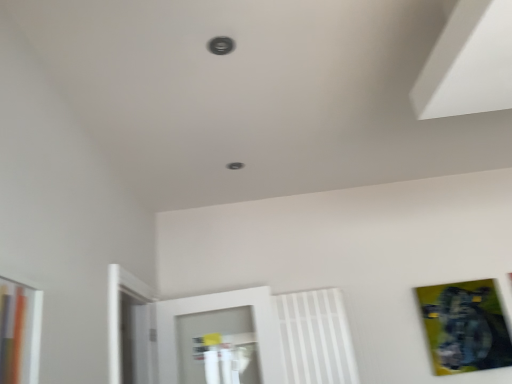
Find the location of a particular element. The width and height of the screenshot is (512, 384). white plastic radiator at center is located at coordinates (315, 337).

What do you see at coordinates (221, 45) in the screenshot? The height and width of the screenshot is (384, 512). I see `metallic circular hole at upper center, marked as the first hole in a top-to-bottom arrangement` at bounding box center [221, 45].

You are a GUI agent. You are given a task and a screenshot of the screen. Output one action in this format:
    pyautogui.click(x=<x>, y=<y>)
    Task: Click on the metallic gold picture frame at lower right
    Image resolution: width=512 pixels, height=384 pixels.
    Given the screenshot: What is the action you would take?
    pyautogui.click(x=465, y=327)

Describe the element at coordinates (465, 327) in the screenshot. I see `metallic gold picture frame at lower right` at that location.

At what (x,y) coordinates should I click in order to perform the action: click on white plastic radiator at center. Please return your answer as a coordinate pair (x, y). The width and height of the screenshot is (512, 384). Looking at the image, I should click on (315, 337).

From the picture: Is metallic gold picture frame at lower right wider or thinner than white plastic radiator at center?

Considering their sizes, metallic gold picture frame at lower right looks slimmer than white plastic radiator at center.

From a real-world perspective, who is located higher, metallic gold picture frame at lower right or white plastic radiator at center?

white plastic radiator at center is physically above.

Who is bigger, metallic gold picture frame at lower right or white plastic radiator at center?

white plastic radiator at center is bigger.

Considering the positions of points (426, 324) and (337, 345), is point (426, 324) closer to camera compared to point (337, 345)?

No.

Does metallic circular hole at upper center, acting as the 1th hole starting from the front, have a greater height compared to metallic gold picture frame at lower right?

In fact, metallic circular hole at upper center, acting as the 1th hole starting from the front, may be shorter than metallic gold picture frame at lower right.

From the image's perspective, between metallic circular hole at upper center, acting as the 1th hole starting from the front, and metallic gold picture frame at lower right, which one is located above?

metallic circular hole at upper center, acting as the 1th hole starting from the front, appears higher in the image.

Considering the sizes of objects metallic circular hole at upper center, positioned as the second hole in back-to-front order, and metallic gold picture frame at lower right in the image provided, who is thinner, metallic circular hole at upper center, positioned as the second hole in back-to-front order, or metallic gold picture frame at lower right?

With smaller width is metallic gold picture frame at lower right.

Are metallic gold picture frame at lower right and metallic circular hole at center, which is counted as the second hole, starting from the front, far apart?

Yes, metallic gold picture frame at lower right is far from metallic circular hole at center, which is counted as the second hole, starting from the front.

In the scene shown: Considering the sizes of metallic gold picture frame at lower right and metallic circular hole at center, marked as the 2th hole in a top-to-bottom arrangement, in the image, is metallic gold picture frame at lower right bigger or smaller than metallic circular hole at center, marked as the 2th hole in a top-to-bottom arrangement,?

Clearly, metallic gold picture frame at lower right is larger in size than metallic circular hole at center, marked as the 2th hole in a top-to-bottom arrangement.

Where is `the 1st hole to the left when counting from the metallic gold picture frame at lower right`? The width and height of the screenshot is (512, 384). the 1st hole to the left when counting from the metallic gold picture frame at lower right is located at coordinates (234, 166).

How many degrees apart are the facing directions of metallic gold picture frame at lower right and metallic circular hole at center, which is counted as the second hole, starting from the front?

0.885 degrees separate the facing orientations of metallic gold picture frame at lower right and metallic circular hole at center, which is counted as the second hole, starting from the front.

From a real-world perspective, which is physically below, metallic circular hole at center, which is counted as the second hole, starting from the front, or metallic circular hole at upper center, positioned as the second hole in back-to-front order?

In real-world perspective, metallic circular hole at upper center, positioned as the second hole in back-to-front order, is lower.

Is metallic circular hole at center, which is counted as the second hole, starting from the front, surrounding metallic circular hole at upper center, marked as the first hole in a top-to-bottom arrangement?

Actually, metallic circular hole at upper center, marked as the first hole in a top-to-bottom arrangement, is outside metallic circular hole at center, which is counted as the second hole, starting from the front.

Between metallic circular hole at center, marked as the 2th hole in a top-to-bottom arrangement, and metallic circular hole at upper center, positioned as the second hole in back-to-front order, which one has less height?

metallic circular hole at upper center, positioned as the second hole in back-to-front order, is shorter.

Could you tell me if metallic circular hole at center, placed as the 1th hole when sorted from bottom to top, is facing metallic circular hole at upper center, which appears as the second hole when ordered from the bottom?

Yes, metallic circular hole at center, placed as the 1th hole when sorted from bottom to top, is turned towards metallic circular hole at upper center, which appears as the second hole when ordered from the bottom.

Which of these two, metallic circular hole at center, which is counted as the first hole, starting from the back, or metallic gold picture frame at lower right, stands taller?

metallic gold picture frame at lower right.

Does point (243, 166) come behind point (484, 337)?

That is False.

Considering the sizes of metallic circular hole at center, which is counted as the first hole, starting from the back, and metallic gold picture frame at lower right in the image, is metallic circular hole at center, which is counted as the first hole, starting from the back, bigger or smaller than metallic gold picture frame at lower right?

Clearly, metallic circular hole at center, which is counted as the first hole, starting from the back, is smaller in size than metallic gold picture frame at lower right.

From the image's perspective, which is below, metallic circular hole at center, placed as the 1th hole when sorted from bottom to top, or metallic gold picture frame at lower right?

metallic gold picture frame at lower right, from the image's perspective.

From a real-world perspective, between white plastic radiator at center and metallic gold picture frame at lower right, who is vertically higher?

From a 3D spatial view, white plastic radiator at center is above.

Is white plastic radiator at center far from metallic gold picture frame at lower right?

No, white plastic radiator at center is in close proximity to metallic gold picture frame at lower right.

Is white plastic radiator at center located outside metallic gold picture frame at lower right?

That's correct, white plastic radiator at center is outside of metallic gold picture frame at lower right.

Which object is more forward, white plastic radiator at center or metallic gold picture frame at lower right?

white plastic radiator at center is in front.

Considering the positions of point (231, 162) and point (308, 302), is point (231, 162) closer or farther from the camera than point (308, 302)?

Point (231, 162) appears to be closer to the viewer than point (308, 302).

Looking at this image, based on their positions, is metallic circular hole at center, placed as the 1th hole when sorted from bottom to top, located to the left or right of white plastic radiator at center?

Based on their positions, metallic circular hole at center, placed as the 1th hole when sorted from bottom to top, is located to the left of white plastic radiator at center.

Locate an element on the screen. radiator that appears below the metallic circular hole at center, placed as the 1th hole when sorted from bottom to top (from a real-world perspective) is located at coordinates (315, 337).

In the scene shown: Is metallic circular hole at center, marked as the 2th hole in a top-to-bottom arrangement, thinner than white plastic radiator at center?

No.

The height and width of the screenshot is (384, 512). What are the coordinates of `picture frame that appears on the right of white plastic radiator at center` in the screenshot? It's located at (465, 327).

The image size is (512, 384). In order to click on the 2nd hole counting from the left side of the metallic gold picture frame at lower right in this screenshot , I will do `click(221, 45)`.

When comparing their distances from metallic circular hole at center, marked as the 2th hole in a top-to-bottom arrangement, does metallic circular hole at upper center, which appears as the second hole when ordered from the bottom, or white plastic radiator at center seem closer?

metallic circular hole at upper center, which appears as the second hole when ordered from the bottom, is positioned closer to the anchor metallic circular hole at center, marked as the 2th hole in a top-to-bottom arrangement.

Based on their spatial positions, is metallic circular hole at upper center, acting as the 1th hole starting from the front, or metallic circular hole at center, which is counted as the second hole, starting from the front, closer to white plastic radiator at center?

Based on the image, metallic circular hole at center, which is counted as the second hole, starting from the front, appears to be nearer to white plastic radiator at center.

Estimate the real-world distances between objects in this image. Which object is closer to white plastic radiator at center, metallic circular hole at upper center, acting as the 1th hole starting from the front, or metallic gold picture frame at lower right?

Based on the image, metallic gold picture frame at lower right appears to be nearer to white plastic radiator at center.

Based on their spatial positions, is white plastic radiator at center or metallic circular hole at center, marked as the 2th hole in a top-to-bottom arrangement, closer to metallic gold picture frame at lower right?

white plastic radiator at center is positioned closer to the anchor metallic gold picture frame at lower right.

Estimate the real-world distances between objects in this image. Which object is closer to metallic gold picture frame at lower right, metallic circular hole at center, which is counted as the second hole, starting from the front, or metallic circular hole at upper center, acting as the 1th hole starting from the front?

metallic circular hole at center, which is counted as the second hole, starting from the front, lies closer to metallic gold picture frame at lower right than the other object.

From the image, which object appears to be nearer to metallic circular hole at center, which is counted as the first hole, starting from the back, white plastic radiator at center or metallic circular hole at upper center, acting as the 1th hole starting from the front?

metallic circular hole at upper center, acting as the 1th hole starting from the front.

When comparing their distances from metallic gold picture frame at lower right, does metallic circular hole at center, which is counted as the first hole, starting from the back, or white plastic radiator at center seem closer?

The object closer to metallic gold picture frame at lower right is white plastic radiator at center.

Based on their spatial positions, is metallic gold picture frame at lower right or white plastic radiator at center closer to metallic circular hole at center, which is counted as the second hole, starting from the front?

Among the two, white plastic radiator at center is located nearer to metallic circular hole at center, which is counted as the second hole, starting from the front.

The width and height of the screenshot is (512, 384). What are the coordinates of `picture frame between metallic circular hole at upper center, positioned as the second hole in back-to-front order, and white plastic radiator at center from top to bottom` in the screenshot? It's located at (465, 327).

At what (x,y) coordinates should I click in order to perform the action: click on hole between metallic circular hole at upper center, acting as the 1th hole starting from the front, and metallic gold picture frame at lower right. Please return your answer as a coordinate pair (x, y). This screenshot has width=512, height=384. Looking at the image, I should click on coord(234,166).

This screenshot has height=384, width=512. What are the coordinates of `radiator between metallic circular hole at center, placed as the 1th hole when sorted from bottom to top, and metallic gold picture frame at lower right from left to right` in the screenshot? It's located at (315, 337).

In order to click on hole that lies between metallic circular hole at upper center, marked as the first hole in a top-to-bottom arrangement, and white plastic radiator at center from top to bottom in this screenshot , I will do `click(234, 166)`.